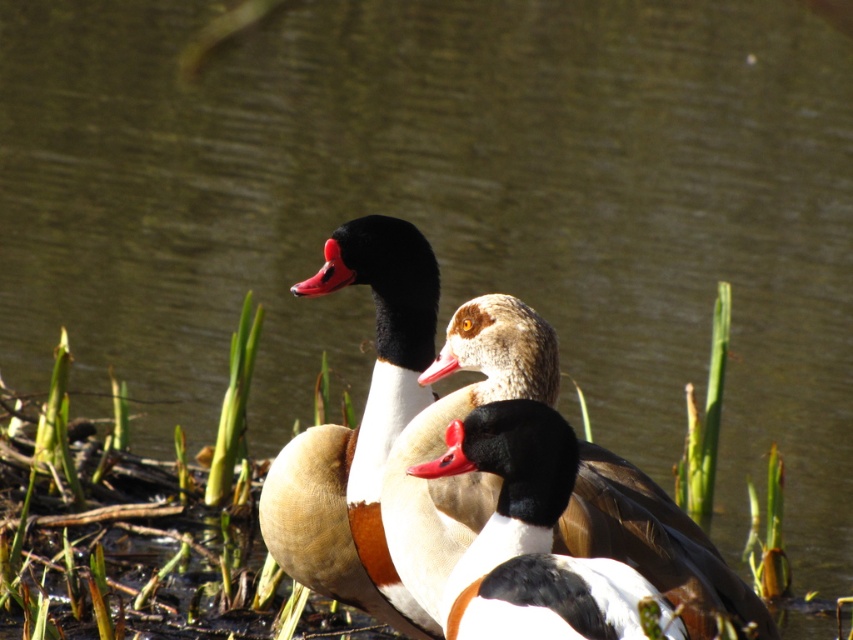
You are a photographer aiming to capture a closeup shot of the brown feathered duck at center and the white glossy duck at center. Which duck should you focus on first to ensure it is in sharp focus?

You should focus on the brown feathered duck at center first because it is closer to you than the white glossy duck at center, ensuring it will be in sharp focus.

You are a wildlife photographer aiming to capture a closeup shot of both the brown feathered duck at center and the white glossy duck at center. Given that your camera has a maximum focus range of 70 centimeters, can you photograph both ducks simultaneously without moving your position?

The brown feathered duck at center and the white glossy duck at center are 73.06 centimeters apart. Since the distance between them exceeds the camera maximum focus range of 70 centimeters, you cannot photograph both ducks simultaneously without moving your position.